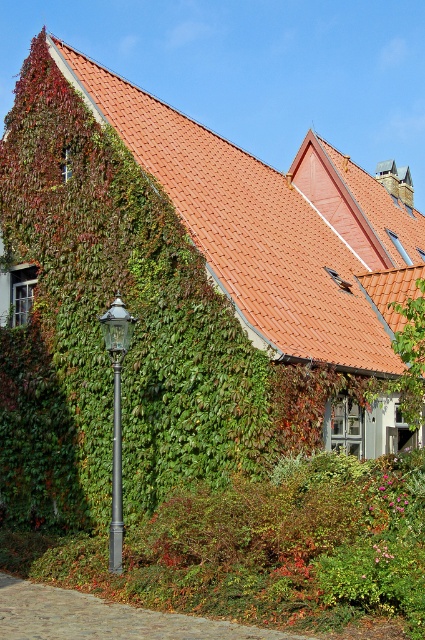
Does point (350, 342) come in front of point (116, 336)?

No, it is behind (116, 336).

Is orange tile roof at upper center further to camera compared to polished metal lamp post at left?

Yes, it is.

Where is `orange tile roof at upper center`? orange tile roof at upper center is located at coordinates (277, 225).

Is orange tile roof at upper center taller than dark gray metallic pole at lower left?

Correct, orange tile roof at upper center is much taller as dark gray metallic pole at lower left.

At what (x,y) coordinates should I click in order to perform the action: click on orange tile roof at upper center. Please return your answer as a coordinate pair (x, y). Looking at the image, I should click on (277, 225).

Can you confirm if polished metal lamp post at left is positioned below dark gray metallic pole at lower left?

No.

In the scene shown: Is polished metal lamp post at left bigger than dark gray metallic pole at lower left?

Indeed, polished metal lamp post at left has a larger size compared to dark gray metallic pole at lower left.

Image resolution: width=425 pixels, height=640 pixels. Identify the location of polished metal lamp post at left. (116, 416).